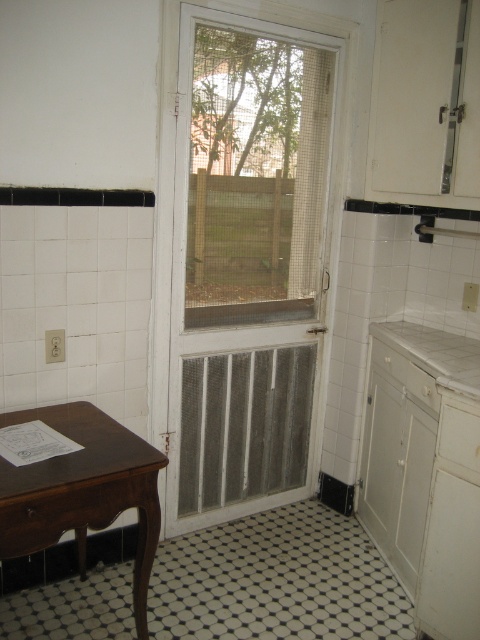
Question: Which of the following is the closest to the observer?

Choices:
 (A) (6, 518)
 (B) (206, 108)

Answer: (A)

Question: Does white mesh screen door at center appear on the left side of clear glass door at center?

Choices:
 (A) no
 (B) yes

Answer: (B)

Question: Does white mesh screen door at center appear on the right side of clear glass door at center?

Choices:
 (A) yes
 (B) no

Answer: (B)

Question: Estimate the real-world distances between objects in this image. Which object is farther from the white laminate countertop at right?

Choices:
 (A) white mesh screen door at center
 (B) brown wood table at lower left
 (C) clear glass door at center

Answer: (B)

Question: Does white mesh screen door at center have a lesser width compared to brown wood table at lower left?

Choices:
 (A) no
 (B) yes

Answer: (A)

Question: Which object is the farthest from the clear glass door at center?

Choices:
 (A) white mesh screen door at center
 (B) brown wood table at lower left

Answer: (B)